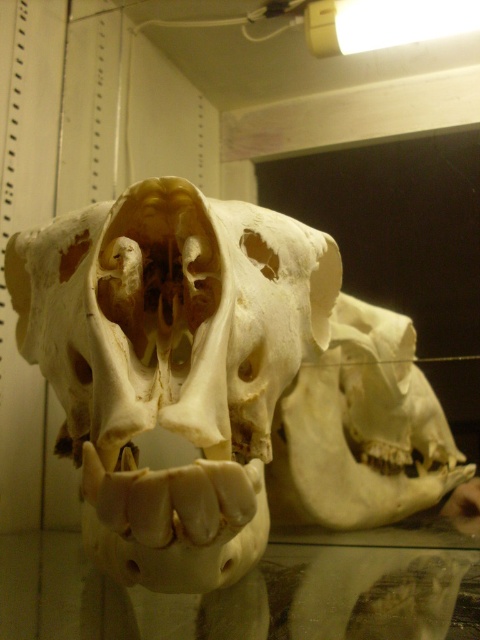
You are a museum visitor holding a small flashlight that is 1 meter long. You want to place it on the transparent glass table at lower center. Considering your position, can the flashlight fit entirely on the table without hanging over the edge?

The transparent glass table at lower center is 1.22 meters from the viewer. Since the flashlight is 1 meter long, it can fit entirely on the table as its length is shorter than the table width. However, the exact placement depends on the table dimensions not provided here, but based on distance, it should be manageable.

You are a museum curator arranging specimens. You need to place a new label next to the transparent glass table at lower center and the white matte skull at center. According to their positions, which object should the label for the skull be placed closer to?

The label for the white matte skull at center should be placed closer to the transparent glass table at lower center since the transparent glass table at lower center is to the left of white matte skull at center.

You are a museum visitor observing the white bone skull at center and the white matte skull at center. Which one is closer to you?

The white bone skull at center is closer to you because it is positioned in front of the white matte skull at center.